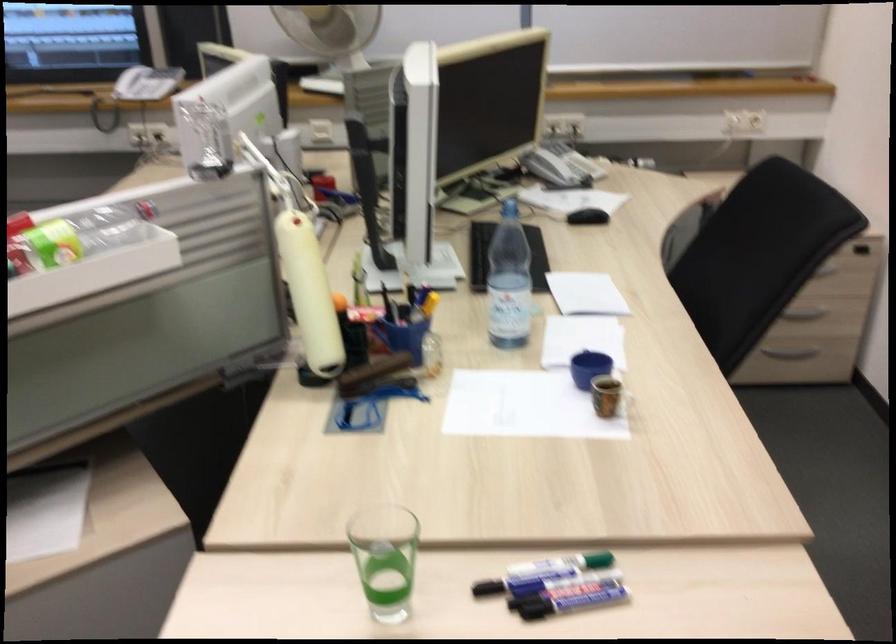
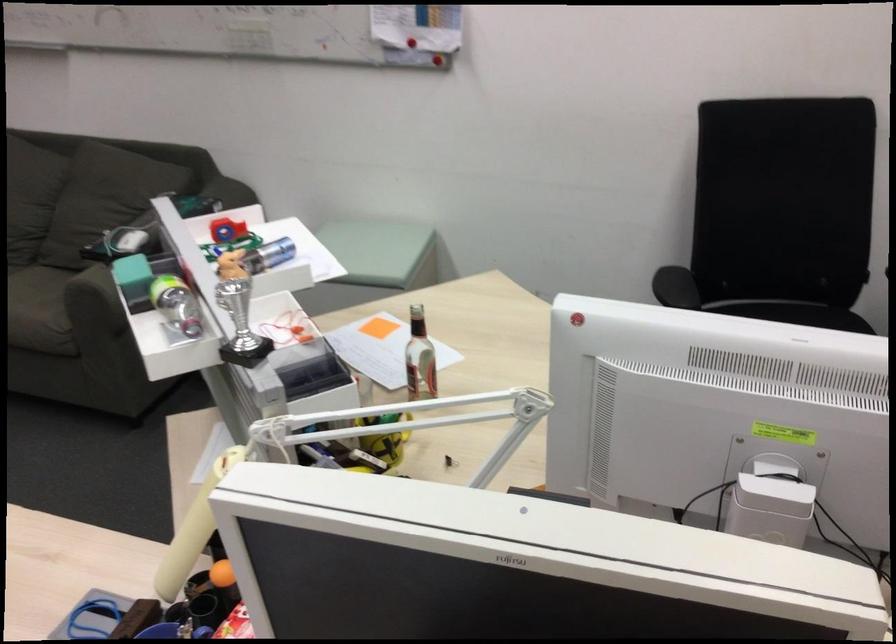
The point at (295,142) is marked in the first image. Where is the corresponding point in the second image?

(770, 509)